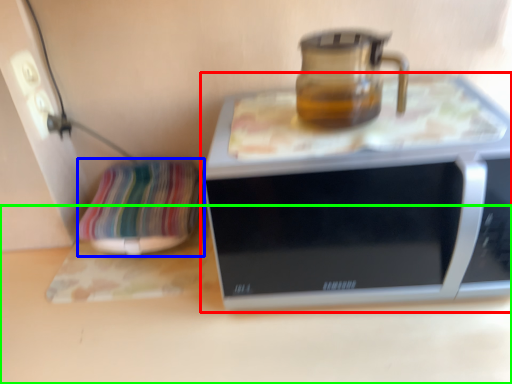
Question: Which object is the closest to the microwave oven (highlighted by a red box)? Choose among these: pillow (highlighted by a blue box) or surface (highlighted by a green box).

Choices:
 (A) pillow
 (B) surface

Answer: (B)